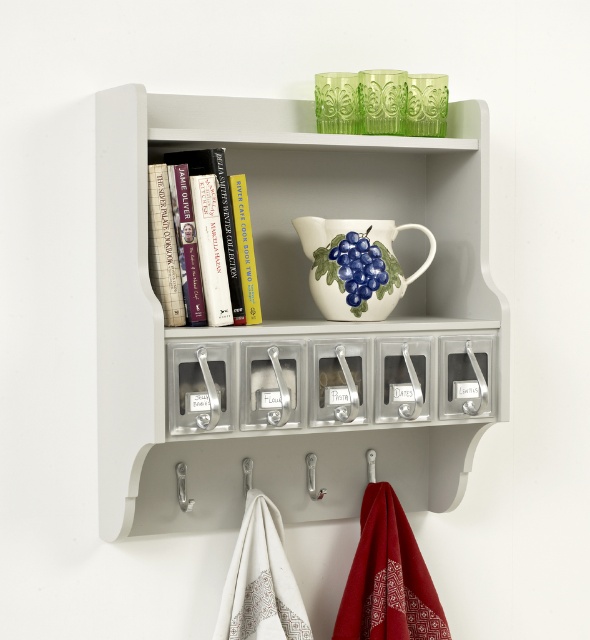
Question: Which is farther from the white ceramic jug at upper center?

Choices:
 (A) white matte bookshelf at upper center
 (B) hardcover books at upper left

Answer: (A)

Question: Is white matte bookshelf at upper center to the left of hardcover books at upper left from the viewer's perspective?

Choices:
 (A) yes
 (B) no

Answer: (B)

Question: Which object is positioned closest to the silver metallic hook at lower left?

Choices:
 (A) hardcover books at upper left
 (B) white ceramic jug at upper center
 (C) white matte bookshelf at upper center

Answer: (C)

Question: Does white ceramic jug at upper center lie behind silver metallic hook at lower left?

Choices:
 (A) no
 (B) yes

Answer: (A)

Question: Which of the following is the closest to the observer?

Choices:
 (A) (x=277, y=456)
 (B) (x=185, y=508)
 (C) (x=349, y=225)
 (D) (x=227, y=198)

Answer: (D)

Question: Does white matte bookshelf at upper center appear over white ceramic jug at upper center?

Choices:
 (A) no
 (B) yes

Answer: (A)